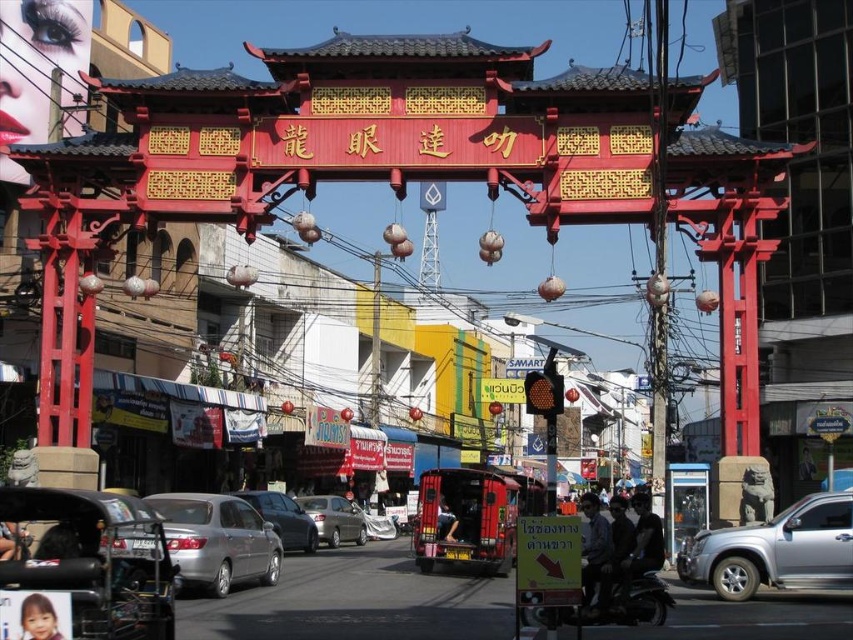
This screenshot has width=853, height=640. What are the coordinates of `silver metallic car at center` in the screenshot? It's located at (283, 518).

Can you confirm if silver metallic car at center is taller than satin silver car at center?

Indeed, silver metallic car at center has a greater height compared to satin silver car at center.

Where is `silver metallic car at center`? This screenshot has height=640, width=853. silver metallic car at center is located at coordinates (283, 518).

Can you confirm if silver metallic suv at center is shorter than silver metallic car at center?

Incorrect, silver metallic suv at center's height does not fall short of silver metallic car at center's.

Who is lower down, silver metallic suv at center or silver metallic car at center?

silver metallic car at center

The height and width of the screenshot is (640, 853). I want to click on silver metallic suv at center, so click(776, 550).

Find the location of `silver metallic suv at center`. silver metallic suv at center is located at coordinates (776, 550).

Can you confirm if metallic silver motorcycle at center is positioned above satin silver car at center?

Yes, metallic silver motorcycle at center is above satin silver car at center.

What do you see at coordinates (614, 604) in the screenshot?
I see `metallic silver motorcycle at center` at bounding box center [614, 604].

Which is behind, point (645, 586) or point (345, 515)?

The point (345, 515) is behind.

Where is `metallic silver motorcycle at center`? This screenshot has width=853, height=640. metallic silver motorcycle at center is located at coordinates (614, 604).